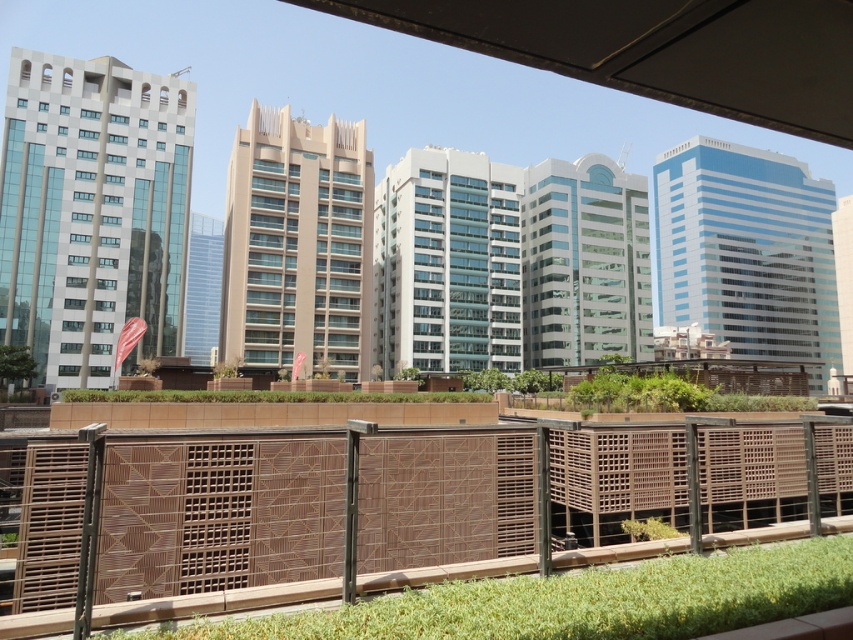
Consider the image. You are standing on a rooftop with a view of the city. There is a brown textured fence at lower center. Can you see the point at coordinates (219,513) from your current position?

The point at coordinates (219,513) is located on the brown textured fence at lower center, so yes, you can see it from your current position on the rooftop.

You are a city planner evaluating the rooftop space shown in the image. You need to determine if the brown textured fence at lower center can be moved to allow more space for the green grass at lower center. Based on their current widths, is this feasible?

The brown textured fence at lower center is wider than the green grass at lower center. If you move the fence, the grass could potentially expand into the space previously occupied by the fence, but since the fence itself is wider, removing it would free up more area for the grass to grow or be expanded.

You are a drone operator trying to deliver a package to a rooftop garden. Your drone has a maximum flight distance of 5 meters before needing to recharge. You see the brown textured fence at lower center and the green grass at lower center. Can your drone safely make the delivery without needing to recharge between the two?

The distance between the brown textured fence at lower center and the green grass at lower center is 6.21 meters. Since the drone can only fly 5 meters before needing to recharge, it cannot safely make the delivery without recharging first.